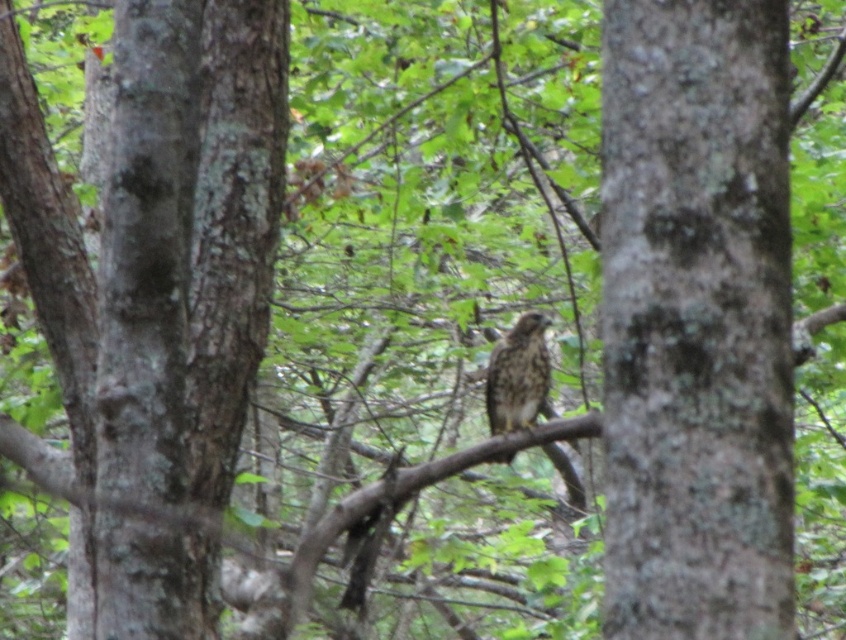
Question: Does rough bark tree at center appear on the right side of brown speckled feathers at center?

Choices:
 (A) no
 (B) yes

Answer: (B)

Question: Which point is closer to the camera taking this photo?

Choices:
 (A) (748, 394)
 (B) (526, 337)

Answer: (A)

Question: Which of the following is the closest to the observer?

Choices:
 (A) brown speckled feathers at center
 (B) rough bark tree at center

Answer: (B)

Question: Does rough bark tree at center appear under brown speckled feathers at center?

Choices:
 (A) yes
 (B) no

Answer: (B)

Question: Does rough bark tree at center have a larger size compared to brown speckled feathers at center?

Choices:
 (A) yes
 (B) no

Answer: (B)